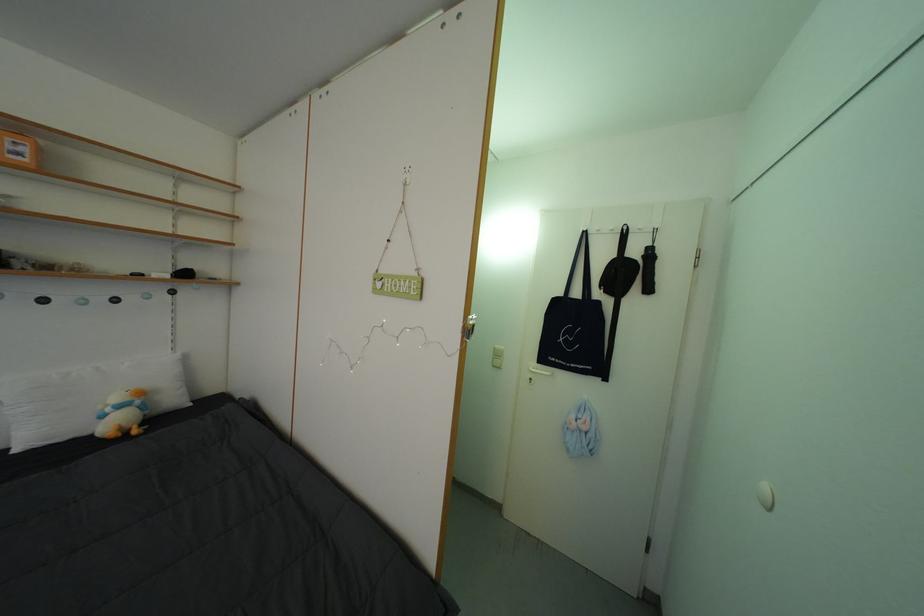
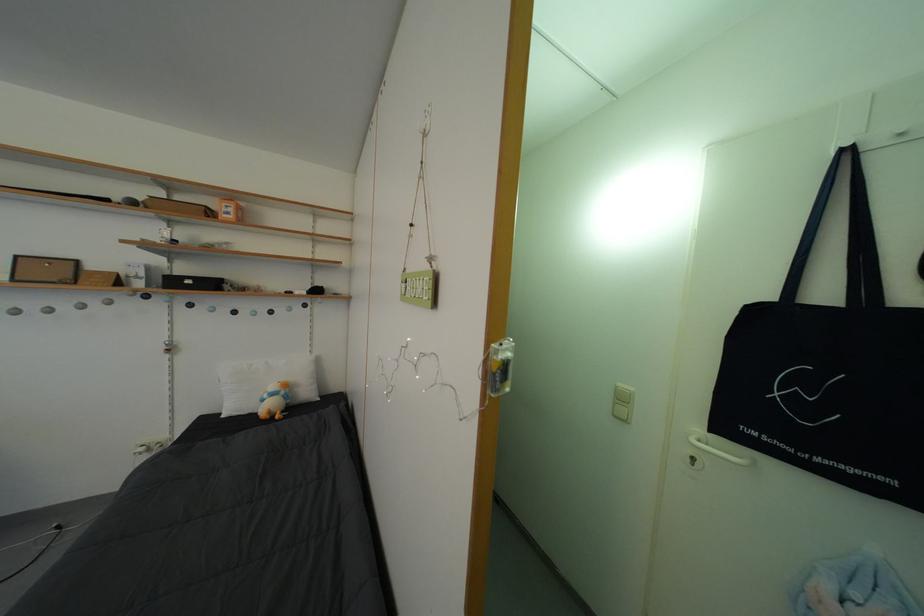
Question: The camera is either moving clockwise (left) or counter-clockwise (right) around the object. The first image is from the beginning of the video and the second image is from the end. Is the camera moving left or right when shooting the video?

Choices:
 (A) Left
 (B) Right

Answer: (B)